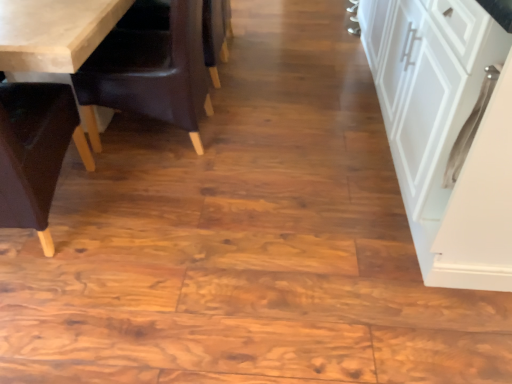
Question: Is brown leather chair at left, placed as the second chair when sorted from left to right, wider than dark brown leather armchair at center?

Choices:
 (A) no
 (B) yes

Answer: (A)

Question: Considering the relative positions of brown leather chair at left, placed as the second chair when sorted from left to right, and dark brown leather armchair at center in the image provided, is brown leather chair at left, placed as the second chair when sorted from left to right, to the right of dark brown leather armchair at center from the viewer's perspective?

Choices:
 (A) no
 (B) yes

Answer: (A)

Question: From the image's perspective, is brown leather chair at left, placed as the second chair when sorted from left to right, over dark brown leather armchair at center?

Choices:
 (A) no
 (B) yes

Answer: (A)

Question: Does brown leather chair at left, placed as the 1th chair when sorted from right to left, have a larger size compared to dark brown leather armchair at center?

Choices:
 (A) no
 (B) yes

Answer: (B)

Question: Is dark brown leather armchair at center inside brown leather chair at left, placed as the 1th chair when sorted from right to left?

Choices:
 (A) yes
 (B) no

Answer: (B)

Question: From a real-world perspective, is brown leather chair at left, placed as the second chair when sorted from left to right, positioned over dark brown leather armchair at center based on gravity?

Choices:
 (A) yes
 (B) no

Answer: (A)

Question: From the image's perspective, is dark brown leather armchair at center below white matte cabinet at right?

Choices:
 (A) yes
 (B) no

Answer: (B)

Question: Is dark brown leather armchair at center facing towards white matte cabinet at right?

Choices:
 (A) yes
 (B) no

Answer: (B)

Question: Considering the relative sizes of dark brown leather armchair at center and white matte cabinet at right in the image provided, is dark brown leather armchair at center thinner than white matte cabinet at right?

Choices:
 (A) no
 (B) yes

Answer: (B)

Question: Is dark brown leather armchair at center taller than white matte cabinet at right?

Choices:
 (A) no
 (B) yes

Answer: (A)

Question: Considering the relative positions of dark brown leather armchair at center and white matte cabinet at right in the image provided, is dark brown leather armchair at center to the right of white matte cabinet at right from the viewer's perspective?

Choices:
 (A) yes
 (B) no

Answer: (B)

Question: Is dark brown leather armchair at center looking in the opposite direction of white matte cabinet at right?

Choices:
 (A) no
 (B) yes

Answer: (B)

Question: Is white matte cabinet at right positioned behind dark brown leather armchair at center?

Choices:
 (A) yes
 (B) no

Answer: (B)